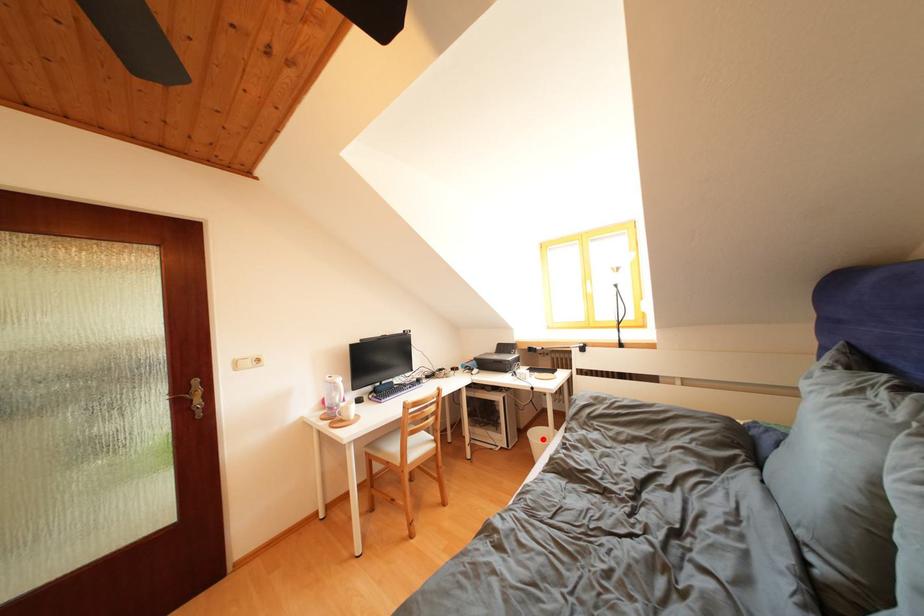
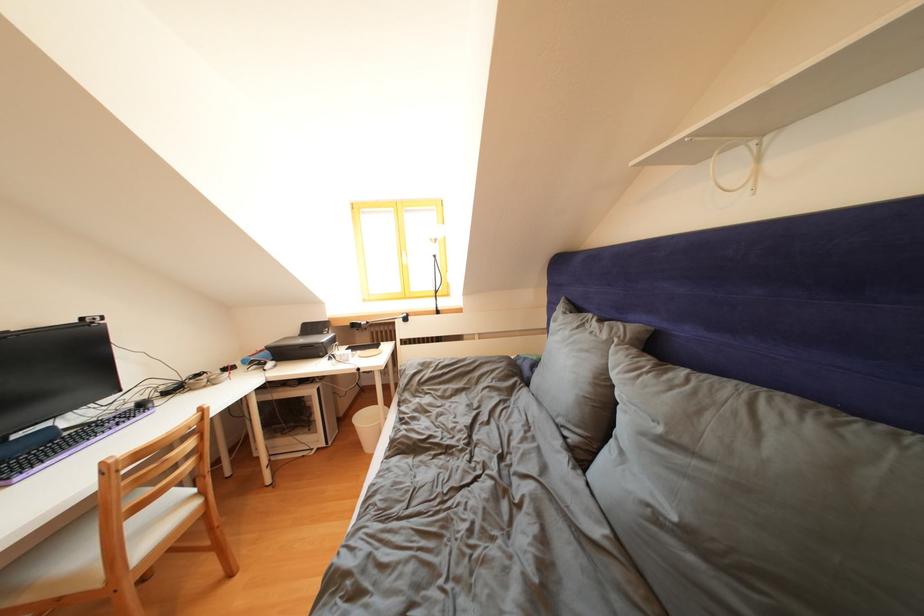
Question: I am providing you with two images of the same scene from different viewpoints. Image1 has a red point marked. In image2, the corresponding 3D location appears at what relative position? Reply with the corresponding letter.

Choices:
 (A) Closer
 (B) Farther

Answer: (A)